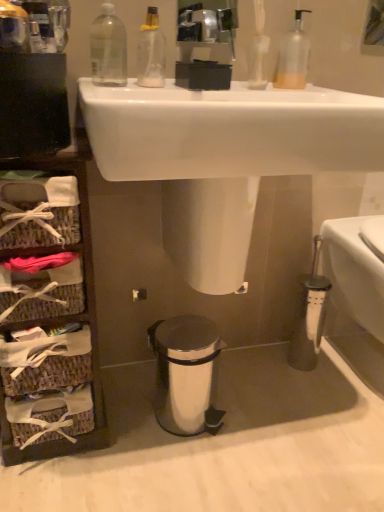
You are a GUI agent. You are given a task and a screenshot of the screen. Output one action in this format:
    pyautogui.click(x=<x>, y=<y>)
    Task: Click on the free space in front of translucent plastic soap dispenser at upper center, acting as the first cleaning product starting from the right
    
    Given the screenshot: What is the action you would take?
    click(299, 91)